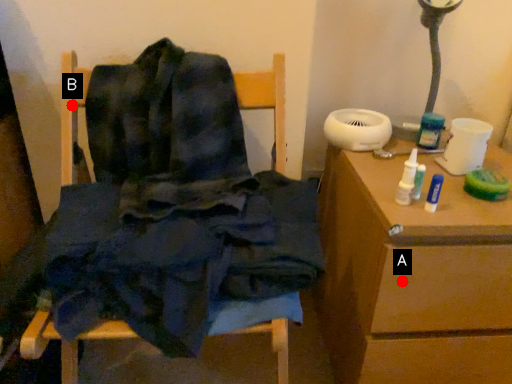
Question: Two points are circled on the image, labeled by A and B beside each circle. Which point is closer to the camera?

Choices:
 (A) A is closer
 (B) B is closer

Answer: (A)